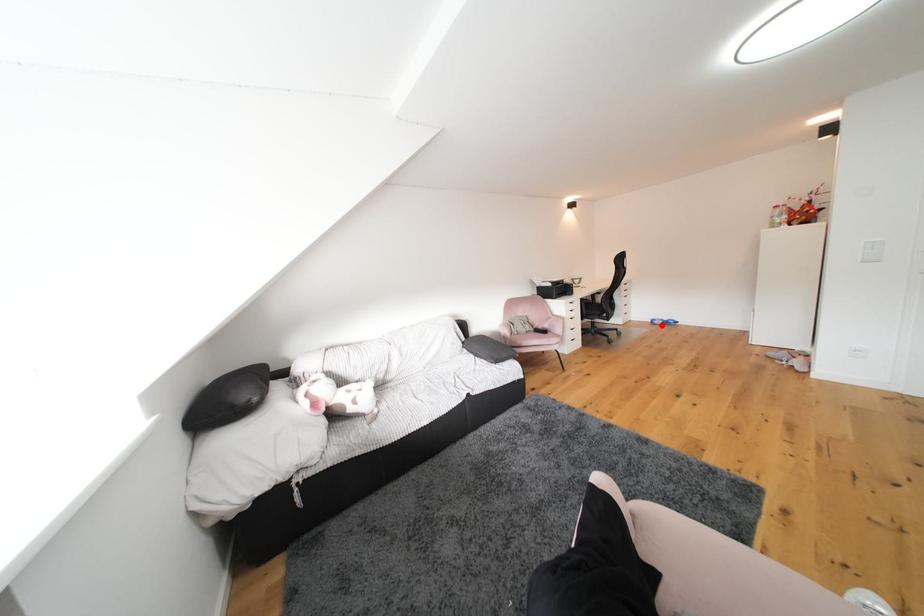
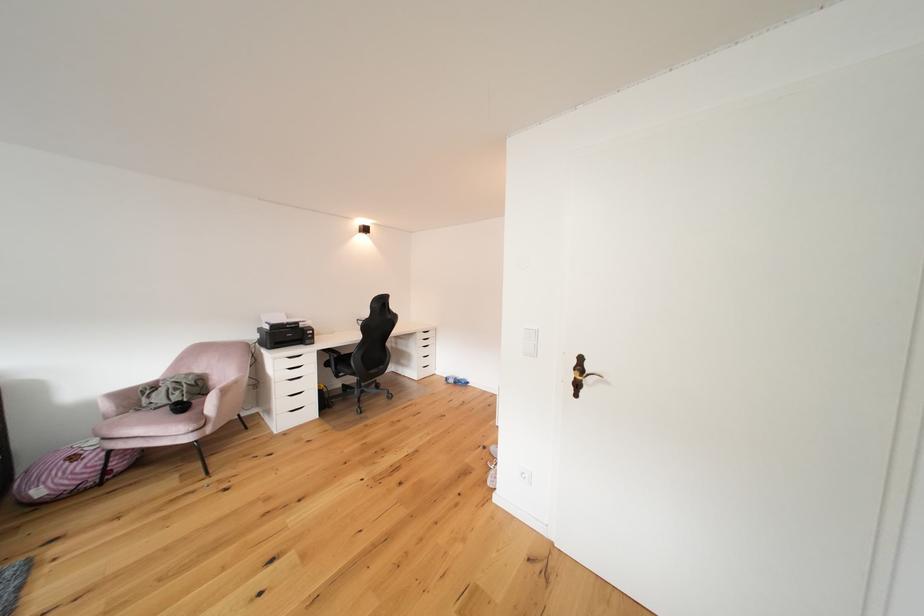
Question: I am providing you with two images of the same scene from different viewpoints. In image1, a red point is highlighted. Considering the same 3D point in image2, which of the following is correct?

Choices:
 (A) It is closer
 (B) It is farther

Answer: (B)